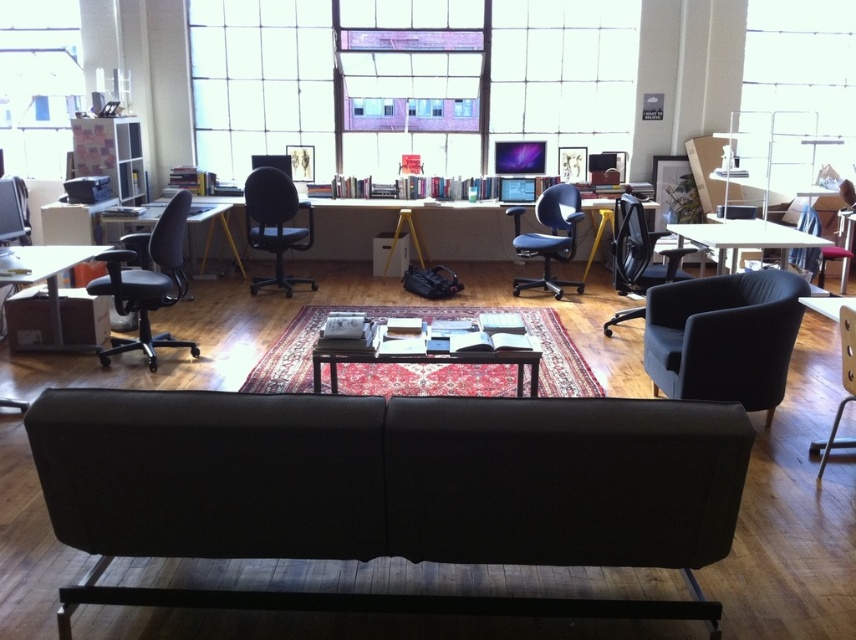
Can you confirm if matte black desk at center is smaller than matte black table at left?

Yes.

Which is in front, point (414, 225) or point (192, 269)?

Positioned in front is point (192, 269).

What are the coordinates of `matte black desk at center` in the screenshot? It's located at pyautogui.click(x=415, y=228).

Where is `matte black desk at center`? matte black desk at center is located at coordinates (415, 228).

Does wooden table at center have a greater height compared to matte black table at left?

No.

Which of these two, wooden table at center or matte black table at left, stands shorter?

wooden table at center

The width and height of the screenshot is (856, 640). Describe the element at coordinates (432, 353) in the screenshot. I see `wooden table at center` at that location.

Where is `wooden table at center`? The height and width of the screenshot is (640, 856). wooden table at center is located at coordinates (432, 353).

Between point (110, 353) and point (27, 268), which one is positioned in front?

Point (27, 268)

Can you confirm if black fabric office chair at left is thinner than matte black table at lower left?

No.

I want to click on black fabric office chair at left, so click(146, 280).